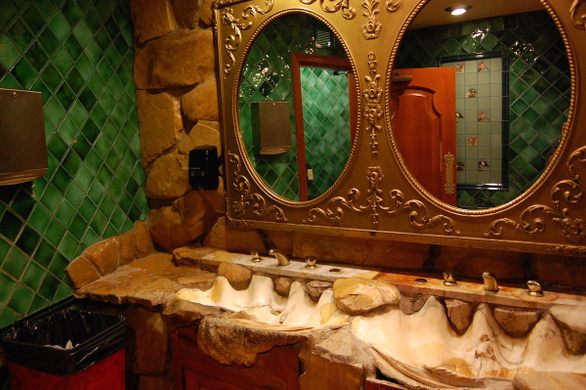
You are a GUI agent. You are given a task and a screenshot of the screen. Output one action in this format:
    pyautogui.click(x=<x>, y=<y>)
    Task: Click on the faucet
    Image resolution: width=586 pixels, height=390 pixels.
    Given the screenshot: What is the action you would take?
    pyautogui.click(x=272, y=251), pyautogui.click(x=286, y=265), pyautogui.click(x=485, y=274), pyautogui.click(x=489, y=288)